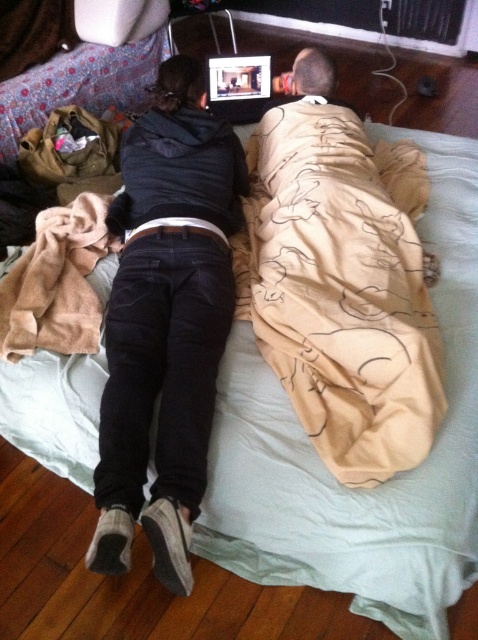
How much distance is there between beige cotton blanket at upper right and black corduroy pants at center?

beige cotton blanket at upper right is 11.52 inches away from black corduroy pants at center.

Can you confirm if beige cotton blanket at upper right is positioned above black corduroy pants at center?

Yes, beige cotton blanket at upper right is above black corduroy pants at center.

The image size is (478, 640). What do you see at coordinates (343, 282) in the screenshot? I see `beige cotton blanket at upper right` at bounding box center [343, 282].

The width and height of the screenshot is (478, 640). I want to click on beige cotton blanket at upper right, so tap(343, 282).